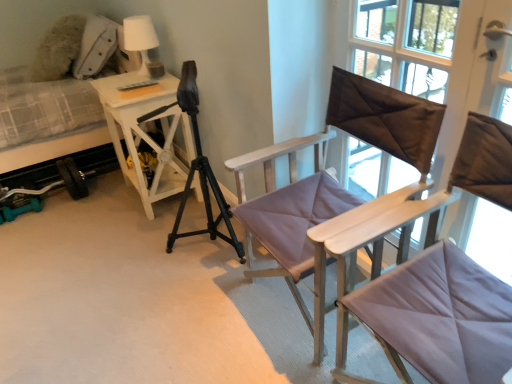
Question: Is matte purple cushioned chair at center, which is the second chair from back to front, bigger or smaller than light purple fabric chair at center, which is the 2th chair from front to back?

Choices:
 (A) small
 (B) big

Answer: (B)

Question: Is point (506, 205) closer or farther from the camera than point (302, 205)?

Choices:
 (A) closer
 (B) farther

Answer: (A)

Question: Which object is the closest to the brown satin pillow at upper right?

Choices:
 (A) matte purple cushioned chair at center, which is the second chair from back to front
 (B) plush fabric hospital bed at left
 (C) white matte table lamp at upper left
 (D) light purple fabric chair at center, marked as the 1th chair in a back-to-front arrangement
 (E) white wood side table at left

Answer: (D)

Question: Estimate the real-world distances between objects in this image. Which object is closer to the light purple fabric chair at center, marked as the 1th chair in a back-to-front arrangement?

Choices:
 (A) white wood side table at left
 (B) matte purple cushioned chair at center, which is the second chair from back to front
 (C) brown satin pillow at upper right
 (D) white matte table lamp at upper left
 (E) plush fabric hospital bed at left

Answer: (B)